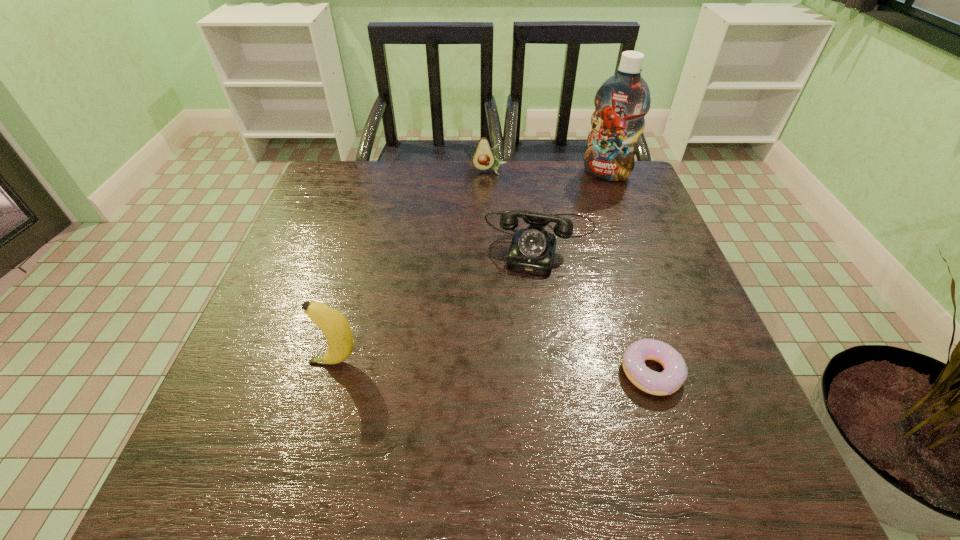
In order to click on free space between the doughnut and the shampoo in this screenshot , I will do `click(629, 273)`.

You are a GUI agent. You are given a task and a screenshot of the screen. Output one action in this format:
    pyautogui.click(x=<x>, y=<y>)
    Task: Click on the object that is the third closest to the avocado
    
    Given the screenshot: What is the action you would take?
    pyautogui.click(x=675, y=372)

Identify which object is the second nearest to the doughnut. Please provide its 2D coordinates. Your answer should be formatted as a tuple, i.e. [(x, y)], where the tuple contains the x and y coordinates of a point satisfying the conditions above.

[(334, 325)]